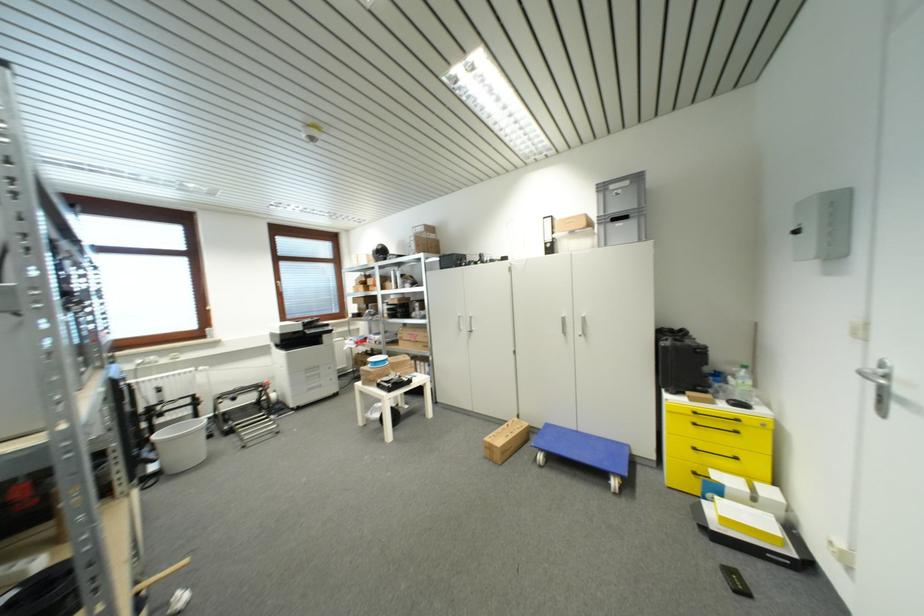
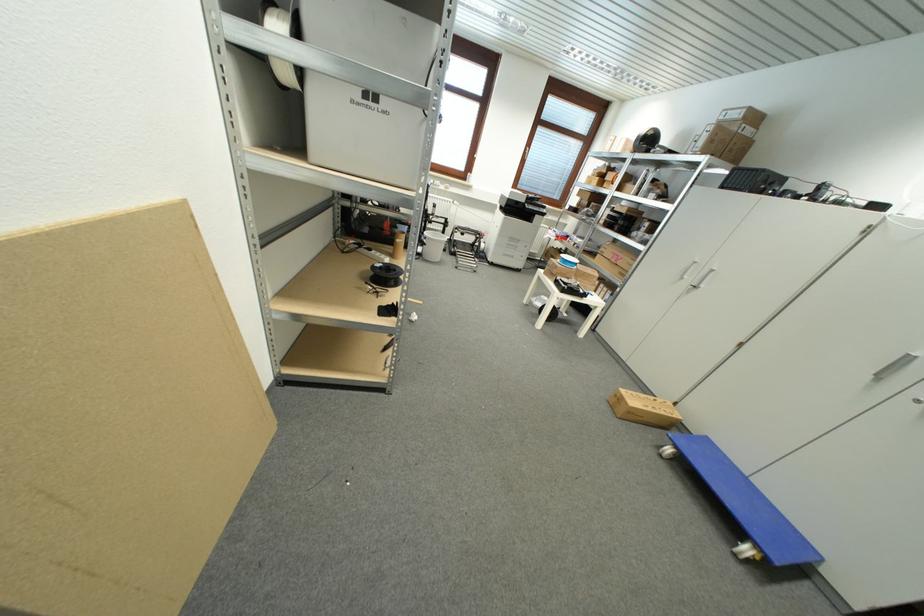
Find the pixel in the second image that matches (x=436, y=238) in the first image.

(754, 134)